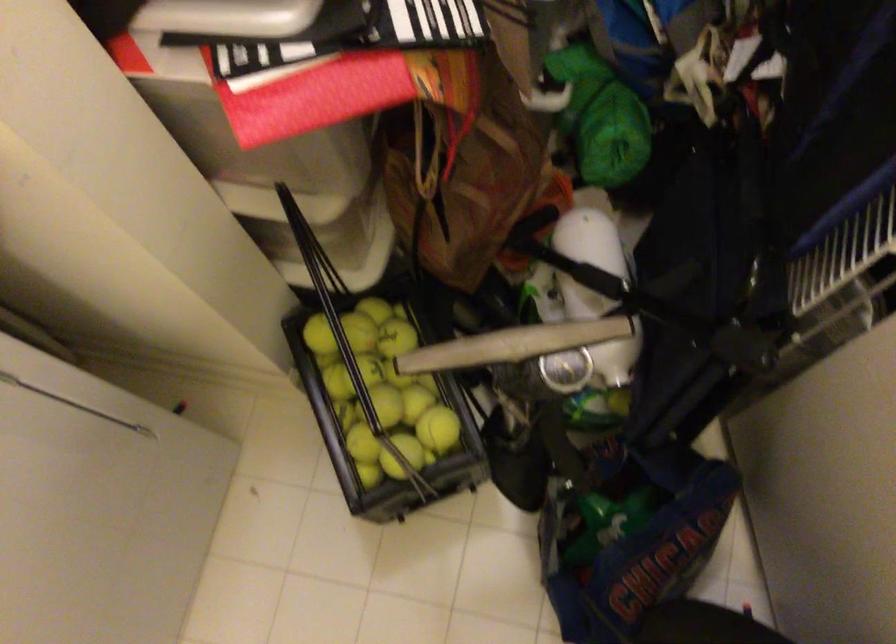
Identify the location of green bottle. The height and width of the screenshot is (644, 896). (607, 522).